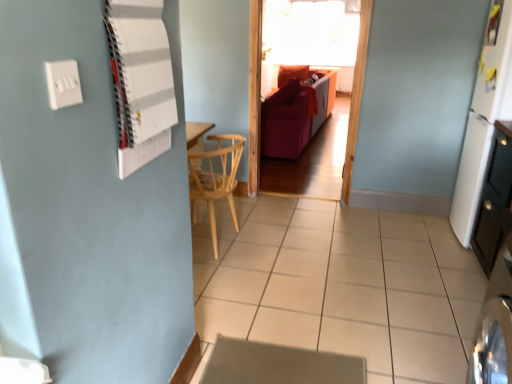
Image resolution: width=512 pixels, height=384 pixels. Identify the location of blank space situated above white tile at center (from a real-world perspective). (334, 279).